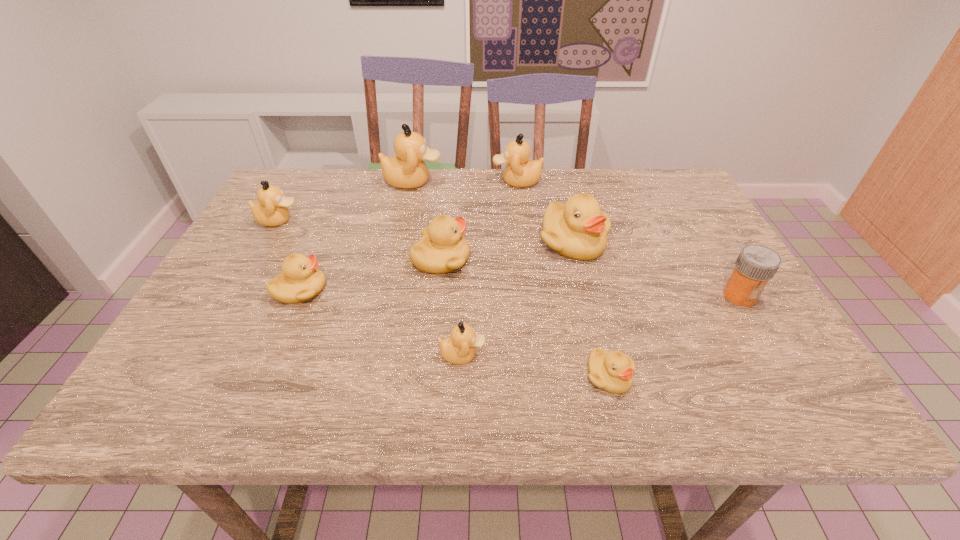
Where is `vacant region that satisfies the following two spatial constraints: 1. on the front-facing side of the biggest yellow duckling; 2. on the front-facing side of the seventh duckling from right to left`? Image resolution: width=960 pixels, height=540 pixels. vacant region that satisfies the following two spatial constraints: 1. on the front-facing side of the biggest yellow duckling; 2. on the front-facing side of the seventh duckling from right to left is located at coordinates (585, 290).

Image resolution: width=960 pixels, height=540 pixels. Identify the location of free spot that satisfies the following two spatial constraints: 1. on the front-facing side of the biggest yellow duckling; 2. on the front-facing side of the second smallest yellow duckling. (585, 290).